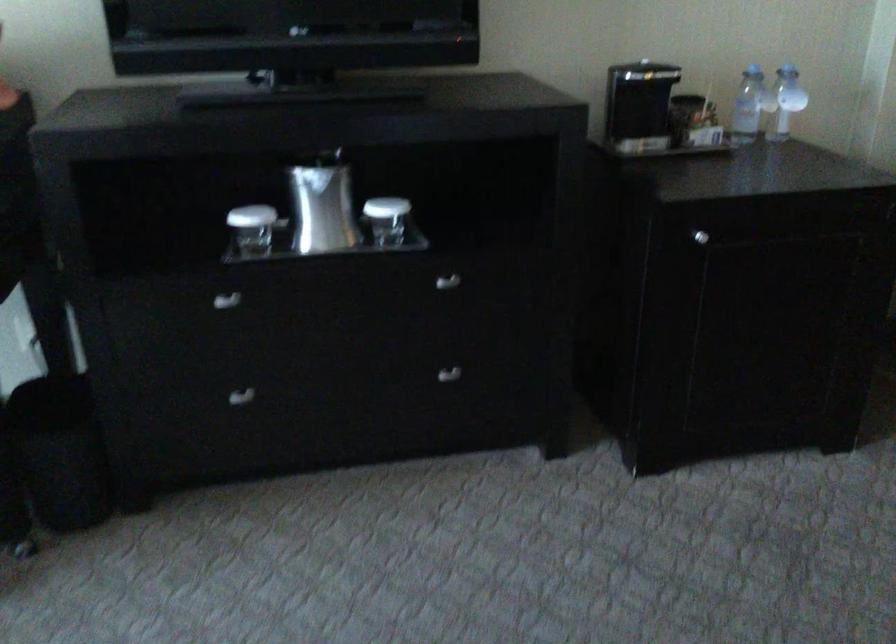
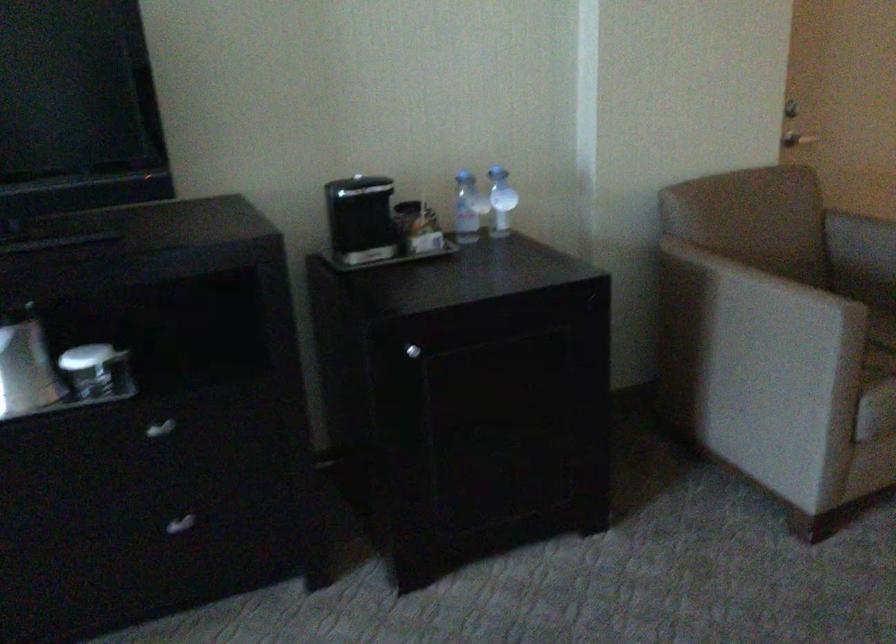
Question: The images are taken continuously from a first-person perspective. In which direction are you moving?

Choices:
 (A) Left
 (B) Right
 (C) Forward
 (D) Backward

Answer: (B)